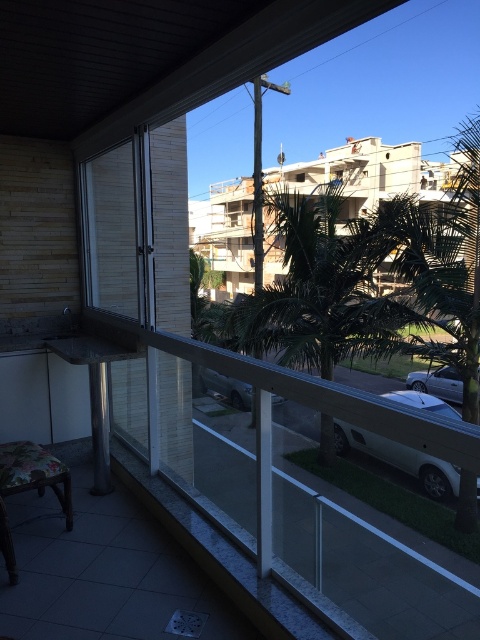
Does white matte car at lower right have a lesser height compared to silver metallic car at lower right?

In fact, white matte car at lower right may be taller than silver metallic car at lower right.

Is white matte car at lower right bigger than silver metallic car at lower right?

Correct, white matte car at lower right is larger in size than silver metallic car at lower right.

What do you see at coordinates (400, 460) in the screenshot?
I see `white matte car at lower right` at bounding box center [400, 460].

Locate an element on the screen. This screenshot has width=480, height=640. white matte car at lower right is located at coordinates (400, 460).

Is point (360, 442) farther from viewer compared to point (7, 456)?

No, (360, 442) is closer to viewer.

What do you see at coordinates (400, 460) in the screenshot? I see `white matte car at lower right` at bounding box center [400, 460].

The image size is (480, 640). Find the location of `white matte car at lower right`. white matte car at lower right is located at coordinates (400, 460).

Between floral fabric cushion at lower left and silver metallic car at lower right, which one is positioned lower?

silver metallic car at lower right is lower down.

Who is higher up, floral fabric cushion at lower left or silver metallic car at lower right?

floral fabric cushion at lower left is higher up.

Find the location of a particular element. The width and height of the screenshot is (480, 640). floral fabric cushion at lower left is located at coordinates (28, 486).